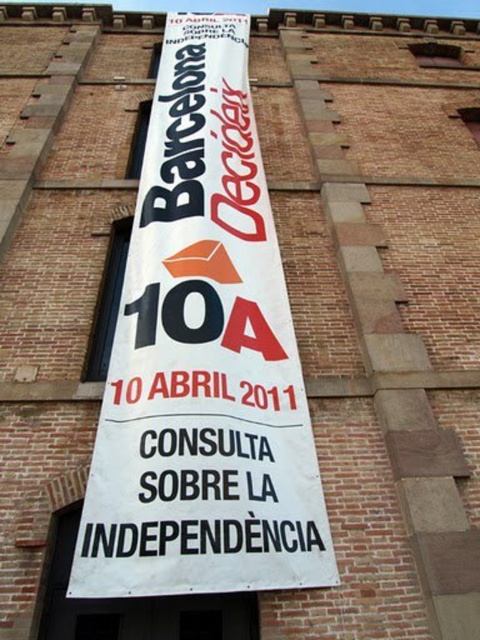
Question: Does white paper banner at center have a greater width compared to black paper text at center?

Choices:
 (A) yes
 (B) no

Answer: (A)

Question: Can you confirm if white paper banner at center is positioned to the right of black paper text at center?

Choices:
 (A) no
 (B) yes

Answer: (A)

Question: Which of the following is the closest to the observer?

Choices:
 (A) (165, 29)
 (B) (231, 429)

Answer: (B)

Question: Is white paper banner at center below black paper text at center?

Choices:
 (A) no
 (B) yes

Answer: (A)

Question: Among these points, which one is farthest from the camera?

Choices:
 (A) (144, 244)
 (B) (216, 529)

Answer: (A)

Question: Which of the following is the farthest from the observer?

Choices:
 (A) black paper text at center
 (B) white paper banner at center

Answer: (A)